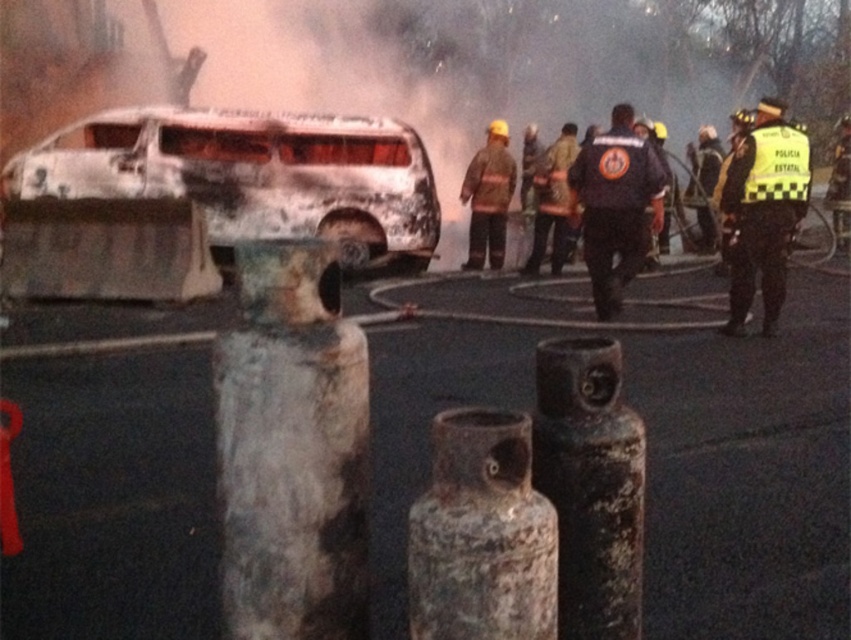
You are a firefighter at the scene of a burning bus. You need to locate both the yellow reflective vest at right and the reflective orange vest at center. From your position, which vest is positioned more to the east?

The yellow reflective vest at right is positioned more to the east because it is to the right of the reflective orange vest at center.

You are a drone operator trying to capture a clear image of the fire scene. You have two points of interest marked as point (x=747, y=154) and point (x=546, y=173). Which point is closer to the camera to ensure better focus?

Point (x=747, y=154) is closer to the camera than point (x=546, y=173), so it will be in better focus.